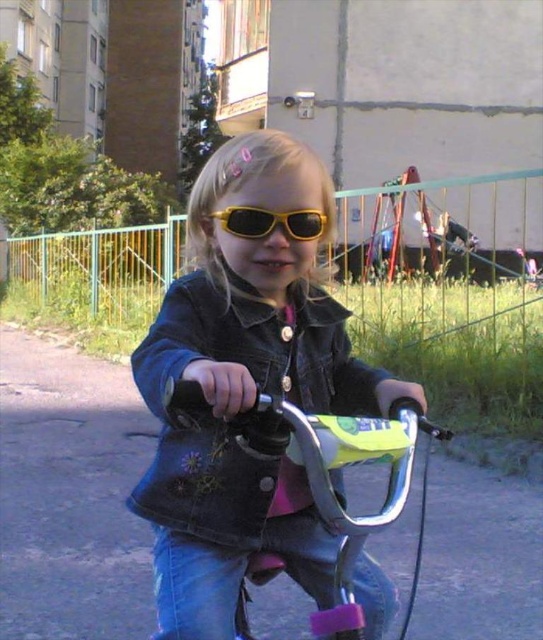
Question: Does metallic silver bicycle handlebars at center lie in front of shiny yellow sunglasses at center?

Choices:
 (A) yes
 (B) no

Answer: (A)

Question: Which is farther from the shiny yellow sunglasses at center?

Choices:
 (A) metallic silver bicycle handlebars at center
 (B) matte black jacket at center

Answer: (A)

Question: Which of the following is the closest to the observer?

Choices:
 (A) (401, 412)
 (B) (185, 499)

Answer: (A)

Question: Among these points, which one is farthest from the camera?

Choices:
 (A) (314, 237)
 (B) (213, 388)

Answer: (A)

Question: Is the position of matte black jacket at center more distant than that of shiny yellow sunglasses at center?

Choices:
 (A) no
 (B) yes

Answer: (A)

Question: Can you confirm if matte black jacket at center is positioned above metallic silver bicycle handlebars at center?

Choices:
 (A) no
 (B) yes

Answer: (B)